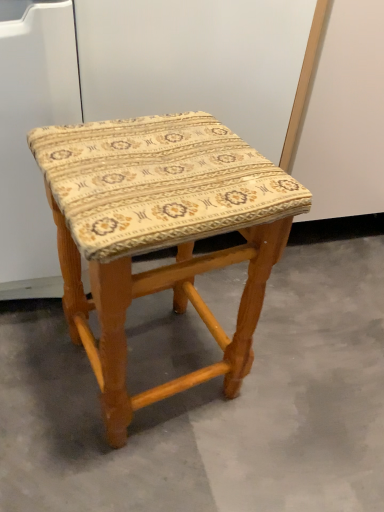
Locate an element on the screen. Image resolution: width=384 pixels, height=512 pixels. free spot above wooden stool at center (from a real-world perspective) is located at coordinates (165, 156).